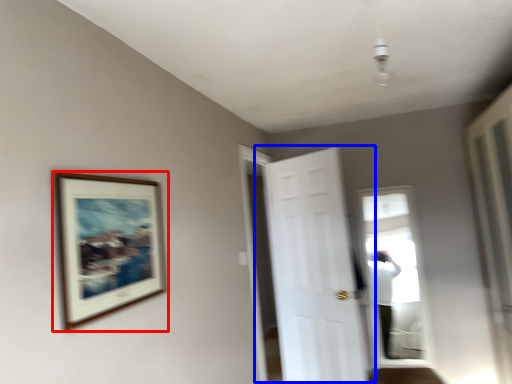
Question: Which of the following is the farthest to the observer, picture frame (highlighted by a red box) or door (highlighted by a blue box)?

Choices:
 (A) picture frame
 (B) door

Answer: (B)